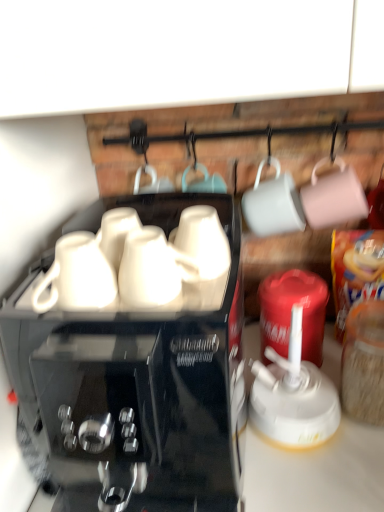
Question: In terms of width, does black glossy coffee maker at center look wider or thinner when compared to white glossy mug at center, the first mug in the right-to-left sequence?

Choices:
 (A) thin
 (B) wide

Answer: (B)

Question: Considering the positions of point [213, 455] and point [192, 220], is point [213, 455] closer or farther from the camera than point [192, 220]?

Choices:
 (A) closer
 (B) farther

Answer: (B)

Question: Estimate the real-world distances between objects in this image. Which object is closer to the black glossy coffee maker at center?

Choices:
 (A) white glossy mug at center, acting as the 2th mug starting from the left
 (B) white glossy mug at center, which is counted as the second mug, starting from the right

Answer: (B)

Question: Estimate the real-world distances between objects in this image. Which object is closer to the black glossy coffee maker at center?

Choices:
 (A) white glossy mug at center, which appears as the first mug when viewed from the left
 (B) white glossy mug at center, the first mug in the right-to-left sequence

Answer: (A)